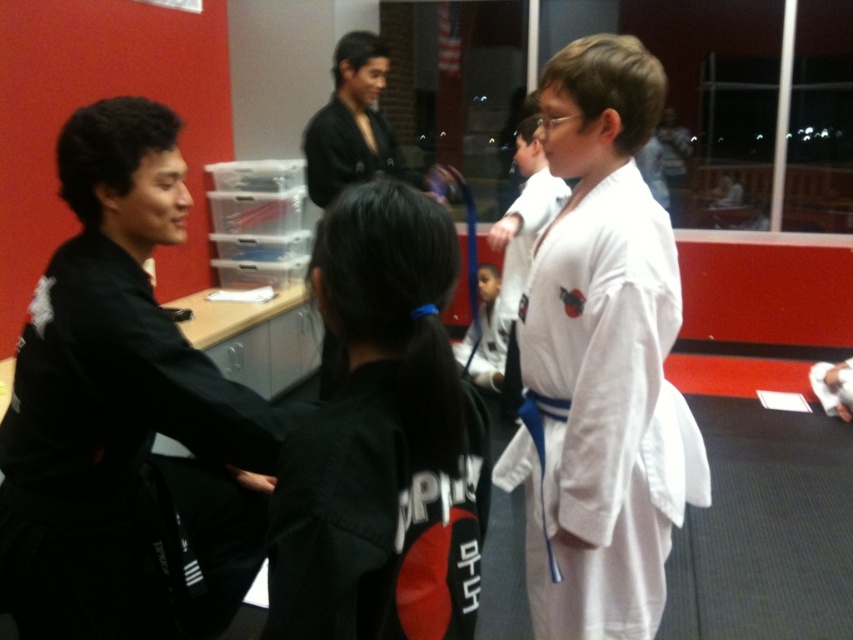
You are a new student in the dojo and need to choose between the black matte uniform at left and the black fabric uniform at center. Which one is bigger?

The black matte uniform at left is larger than the black fabric uniform at center.

You are a new student in the dojo and need to find the black fabric uniform at center. Where would you look relative to the black matte robe at upper center?

The black fabric uniform at center is located below the black matte robe at upper center, so you should look downward from the black matte robe at upper center to find it.

You are a student in the dojo and need to find your uniform. You see the black matte uniform at left and the black fabric uniform at center. Which one is lower in position?

The black matte uniform at left is located below the black fabric uniform at center, so it is lower in position.